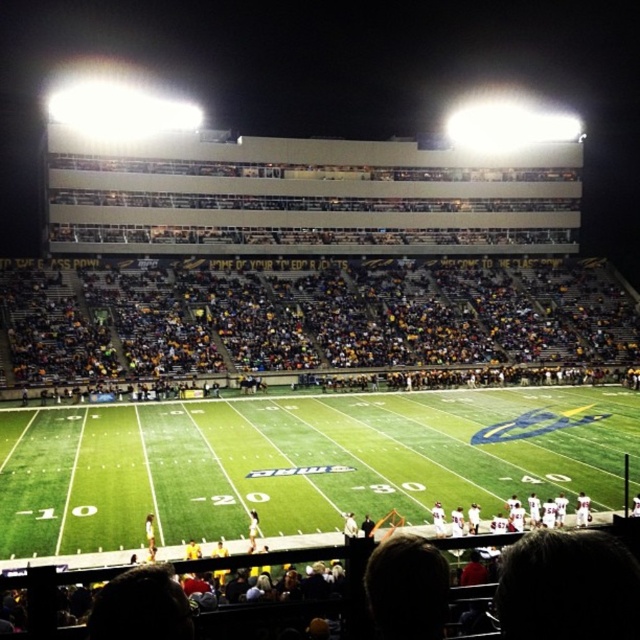
From the picture: You are a photographer standing at the edge of the green turf football field at center. You want to take a photo of the yellow fabric seats at lower center. Which direction should you move to get a better view of the seats without blocking the field?

The green turf football field at center is in front of the yellow fabric seats at lower center, so you should move backward away from the field to get a better view of the seats without blocking them.

You are standing at the point with coordinates point (13,536) in the football stadium. You want to take a photo of the entire field using a camera that has a maximum range of 100 feet. Can you capture the entire field from your current position?

The distance between point (13,536) and the camera is 99.55 feet, which is within the camera maximum range of 100 feet. Therefore, you can capture the entire field from your current position.

You are a drone operator trying to capture a live football game. Your drone is currently at coordinates point 0.722, 0.472. Where should you direct your drone to get a clear view of the green turf football field at center?

The green turf football field at center is located at point (301, 461), so directing the drone to those coordinates will provide a clear view of it.